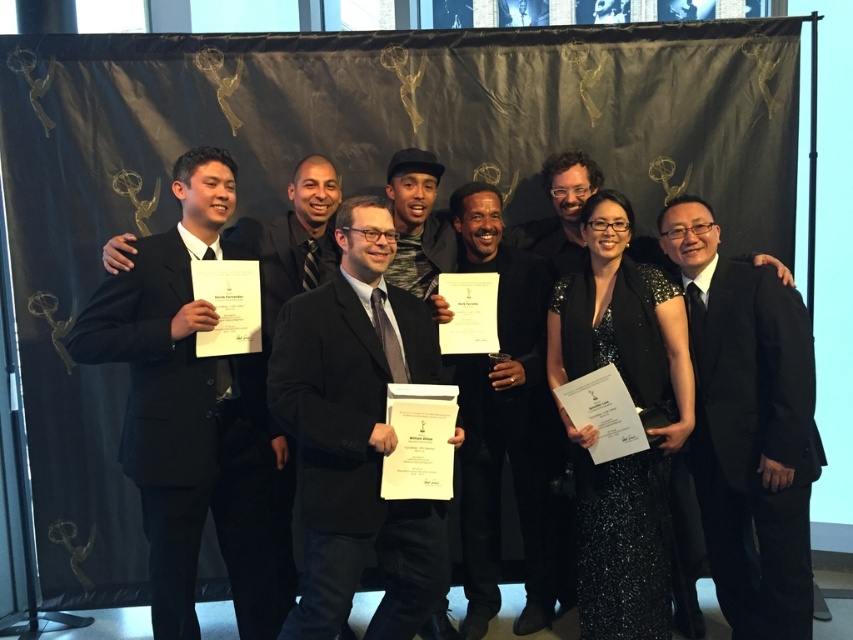
Can you confirm if matte black suit at center is shorter than black matte suit at center?

Yes.

Does matte black suit at center have a larger size compared to black matte suit at center?

No.

Between point (407, 593) and point (518, 273), which one is positioned behind?

The point (518, 273) is more distant.

The height and width of the screenshot is (640, 853). In order to click on matte black suit at center in this screenshot , I will do `click(357, 435)`.

How far apart are black suit at left and matte black suit at center?

black suit at left is 17.45 inches away from matte black suit at center.

Between point (196, 204) and point (389, 234), which one is positioned behind?

The point (196, 204) is behind.

Locate an element on the screen. Image resolution: width=853 pixels, height=640 pixels. black suit at left is located at coordinates (194, 417).

The image size is (853, 640). I want to click on black suit at left, so click(194, 417).

Who is more distant from viewer, (430,540) or (772,406)?

Positioned behind is point (772,406).

Who is positioned more to the left, matte black suit at center or black satin suit at right?

From the viewer's perspective, matte black suit at center appears more on the left side.

Find the location of a particular element. This screenshot has width=853, height=640. matte black suit at center is located at coordinates (357, 435).